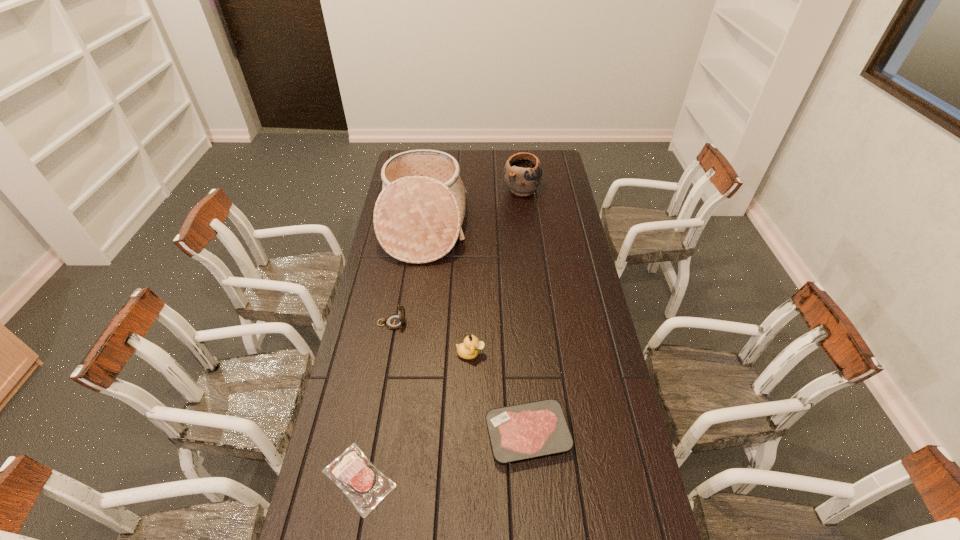
Identify the location of blank space located 0.180m on the face of the fourth nearest object. This screenshot has height=540, width=960. (456, 323).

Find the location of a particular element. This screenshot has width=960, height=540. free space located on the face of the duckling is located at coordinates (595, 354).

I want to click on vacant region located 0.160m on the left of the taller steak, so click(432, 434).

You are a GUI agent. You are given a task and a screenshot of the screen. Output one action in this format:
    pyautogui.click(x=<x>, y=<y>)
    Task: Click on the vacant space located on the right of the left steak
    
    Given the screenshot: What is the action you would take?
    pyautogui.click(x=422, y=479)

Where is `basket that is at the left edge`? basket that is at the left edge is located at coordinates (418, 216).

Find the location of `compass present at the left edge`. compass present at the left edge is located at coordinates (394, 321).

This screenshot has height=540, width=960. In order to click on steak situated at the left edge in this screenshot , I will do click(365, 486).

Locate an element on the screen. object present at the right edge is located at coordinates (522, 173).

Locate an element on the screen. free space at the far edge of the desktop is located at coordinates (479, 152).

This screenshot has width=960, height=540. Find the location of `vacant space at the left edge of the desktop`. vacant space at the left edge of the desktop is located at coordinates [x=392, y=256].